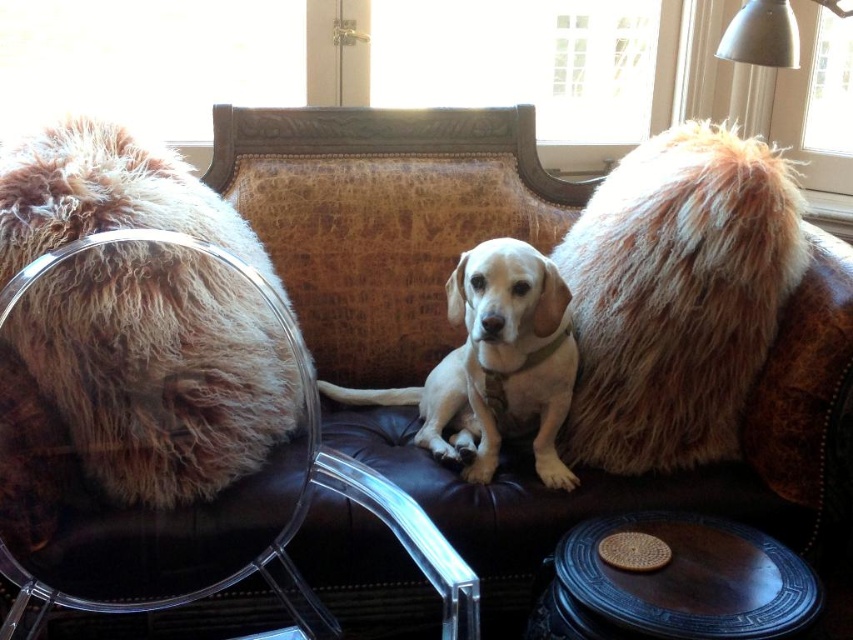
Based on the photo, can you confirm if brown textured armchair at center is taller than fuzzy brown fur at center?

Yes.

Find the location of a particular element. brown textured armchair at center is located at coordinates (160, 396).

At what (x,y) coordinates should I click in order to perform the action: click on brown textured armchair at center. Please return your answer as a coordinate pair (x, y). The height and width of the screenshot is (640, 853). Looking at the image, I should click on (160, 396).

Consider the image. Can you confirm if brown textured armchair at center is positioned to the right of white fur dog at center?

Incorrect, brown textured armchair at center is not on the right side of white fur dog at center.

Locate an element on the screen. The width and height of the screenshot is (853, 640). brown textured armchair at center is located at coordinates (160, 396).

Does point (90, 353) come behind point (479, 289)?

No, it is in front of (479, 289).

Where is `brown textured armchair at center`? This screenshot has height=640, width=853. brown textured armchair at center is located at coordinates (160, 396).

Between brown textured armchair at center and dark brown wooden stool at center, which one appears on the right side from the viewer's perspective?

Positioned to the right is dark brown wooden stool at center.

Between brown textured armchair at center and dark brown wooden stool at center, which one is positioned higher?

Positioned higher is brown textured armchair at center.

Is point (167, 202) positioned behind point (814, 586)?

Yes, point (167, 202) is behind point (814, 586).

Where is `brown textured armchair at center`? brown textured armchair at center is located at coordinates (160, 396).